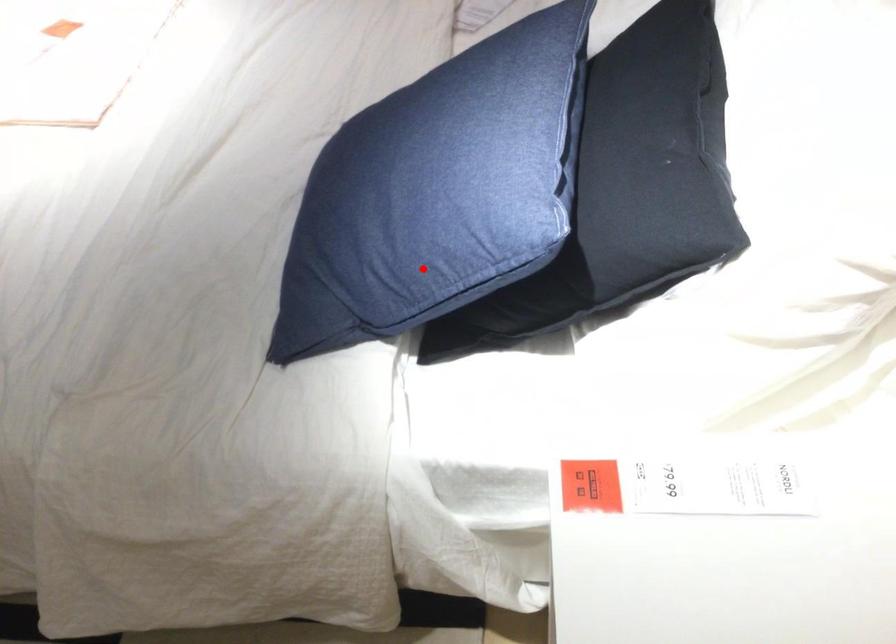
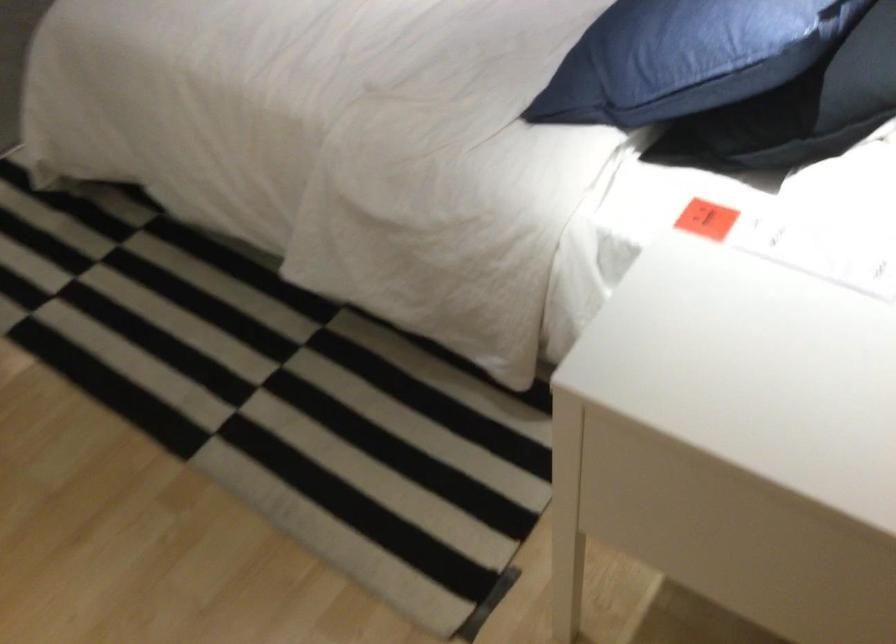
Locate, in the second image, the point that corresponds to the highlighted location in the first image.

(675, 58)